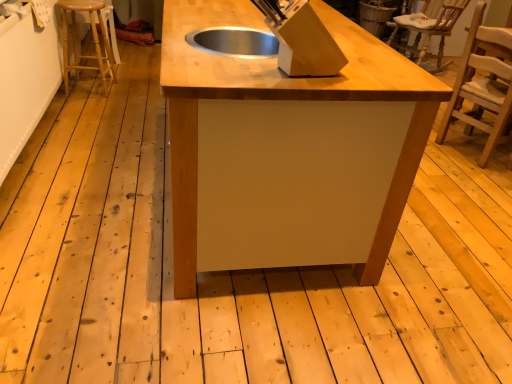
Locate an element on the screen. free space in front of matte wood table at center is located at coordinates (210, 304).